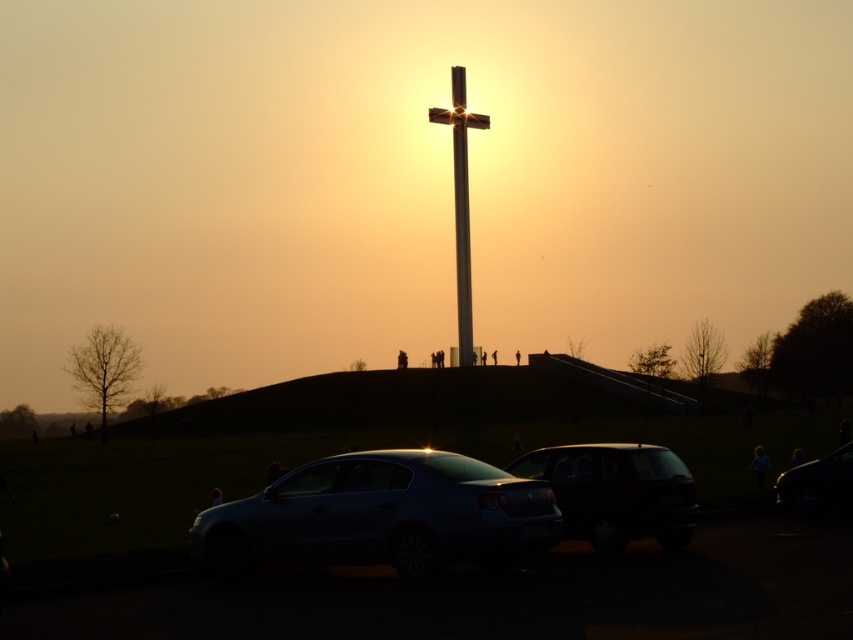
Which is behind, point (374, 625) or point (463, 124)?

The point (463, 124) is behind.

Measure the distance between point (267, 573) and camera.

Point (267, 573) and camera are 14.37 meters apart.

This screenshot has height=640, width=853. What do you see at coordinates (503, 595) in the screenshot?
I see `metallic gray car at lower center` at bounding box center [503, 595].

This screenshot has height=640, width=853. I want to click on metallic gray car at lower center, so click(503, 595).

Can you confirm if metallic gray car at lower center is smaller than shiny black car at center?

Actually, metallic gray car at lower center might be larger than shiny black car at center.

Is point (763, 534) closer to camera compared to point (671, 476)?

No, it is behind (671, 476).

Find the location of `metallic gray car at lower center`. metallic gray car at lower center is located at coordinates (503, 595).

From the picture: Can you confirm if shiny black car at center is positioned to the left of metallic cross at center?

No, shiny black car at center is not to the left of metallic cross at center.

Describe the element at coordinates (616, 492) in the screenshot. This screenshot has width=853, height=640. I see `shiny black car at center` at that location.

Who is more distant from viewer, (685, 516) or (450, 122)?

The point (450, 122) is more distant.

The image size is (853, 640). Find the location of `shiny black car at center`. shiny black car at center is located at coordinates (616, 492).